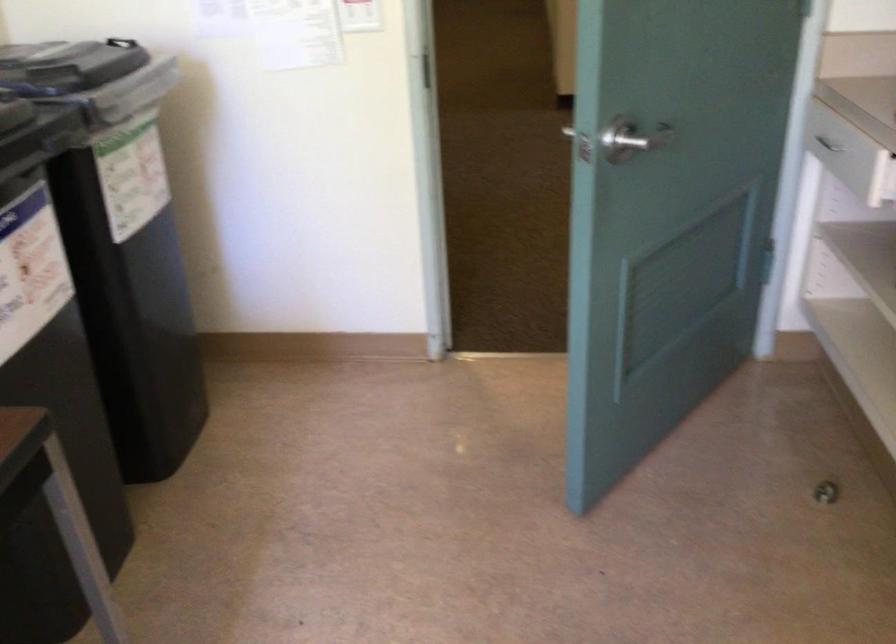
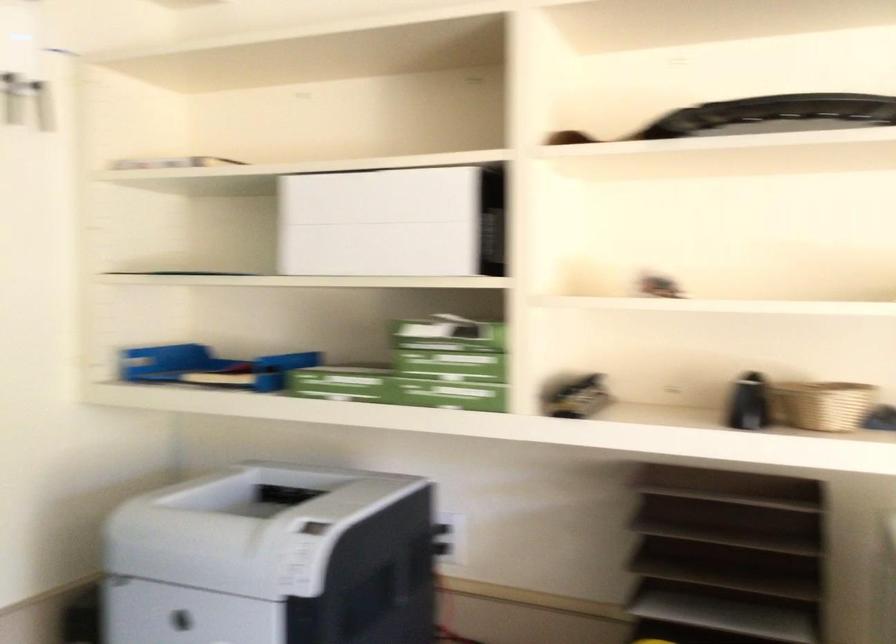
Question: The first image is from the beginning of the video and the second image is from the end. How did the camera likely rotate when shooting the video?

Choices:
 (A) Left
 (B) Right
 (C) Up
 (D) Down

Answer: (B)